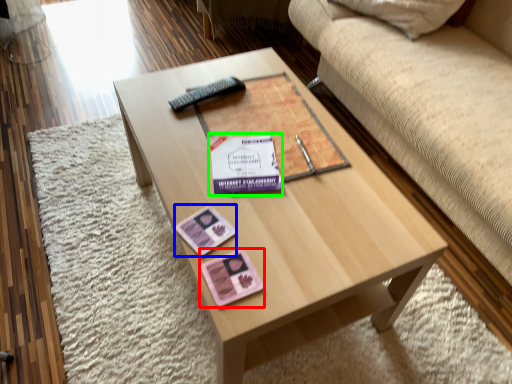
Question: Which is farther away from currency (highlighted by a red box)? currency (highlighted by a blue box) or paperback book (highlighted by a green box)?

Choices:
 (A) currency
 (B) paperback book

Answer: (B)